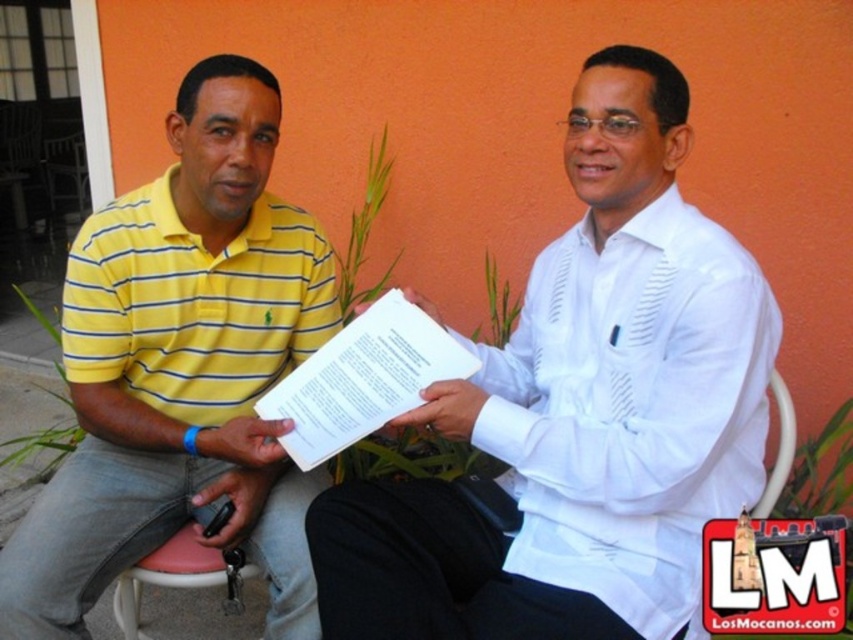
Question: Is yellow striped polo shirt at left bigger than white paper at center?

Choices:
 (A) yes
 (B) no

Answer: (A)

Question: Is yellow striped polo shirt at left below pink plastic chair at lower left?

Choices:
 (A) no
 (B) yes

Answer: (A)

Question: Is white paper at center above pink plastic chair at lower left?

Choices:
 (A) yes
 (B) no

Answer: (A)

Question: Which of these objects is positioned farthest from the white textured shirt at center?

Choices:
 (A) yellow striped polo shirt at left
 (B) pink plastic chair at lower left

Answer: (B)

Question: Which point is closer to the camera taking this photo?

Choices:
 (A) (173, 305)
 (B) (387, 548)

Answer: (B)

Question: Which point is farther to the camera?

Choices:
 (A) white textured shirt at center
 (B) white paper at center

Answer: (B)